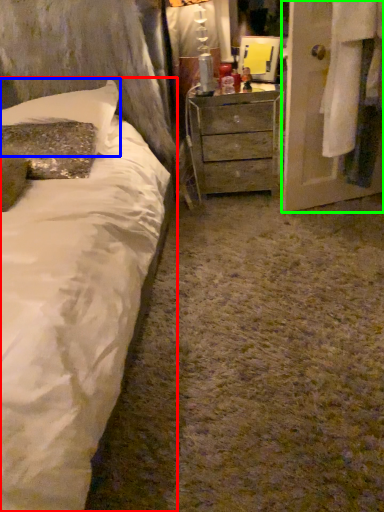
Question: Considering the real-world distances, which object is farthest from bed (highlighted by a red box)? pillow (highlighted by a blue box) or armoire (highlighted by a green box)?

Choices:
 (A) pillow
 (B) armoire

Answer: (B)